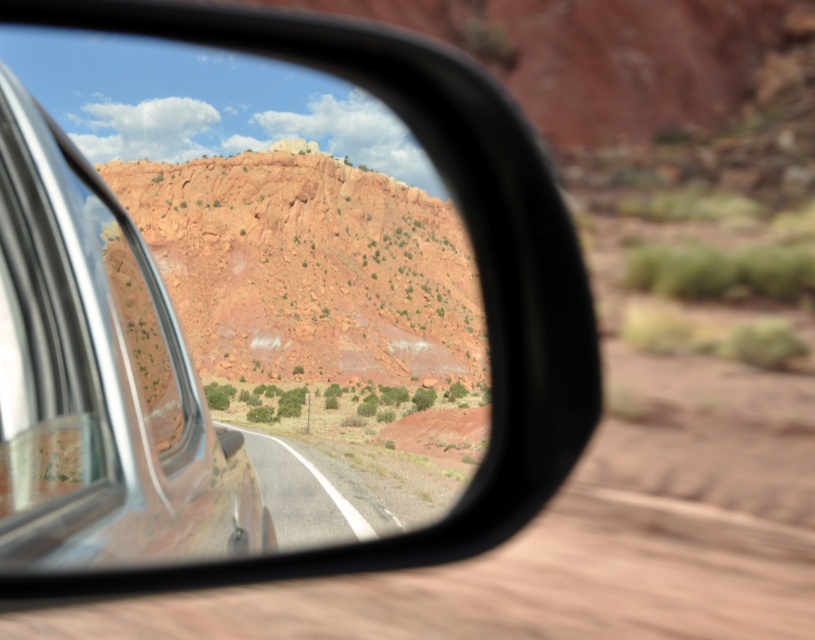
Is black glossy mirror at upper left shorter than brushed metal car window at left?

Incorrect, black glossy mirror at upper left's height does not fall short of brushed metal car window at left's.

Is black glossy mirror at upper left further to the viewer compared to brushed metal car window at left?

Yes, black glossy mirror at upper left is further from the viewer.

What are the coordinates of `black glossy mirror at upper left` in the screenshot? It's located at tap(476, 259).

Which of these two, black glossy mirror at upper left or smooth asphalt road at center, stands shorter?

With less height is smooth asphalt road at center.

Is point (514, 392) positioned before point (258, 454)?

Yes, point (514, 392) is in front of point (258, 454).

Where is `black glossy mirror at upper left`? The width and height of the screenshot is (815, 640). black glossy mirror at upper left is located at coordinates (476, 259).

Is brushed metal car window at left to the right of smooth asphalt road at center from the viewer's perspective?

Indeed, brushed metal car window at left is positioned on the right side of smooth asphalt road at center.

Who is positioned more to the right, brushed metal car window at left or smooth asphalt road at center?

brushed metal car window at left is more to the right.

The image size is (815, 640). Find the location of `brushed metal car window at left`. brushed metal car window at left is located at coordinates (87, 369).

The height and width of the screenshot is (640, 815). Find the location of `brushed metal car window at left`. brushed metal car window at left is located at coordinates click(87, 369).